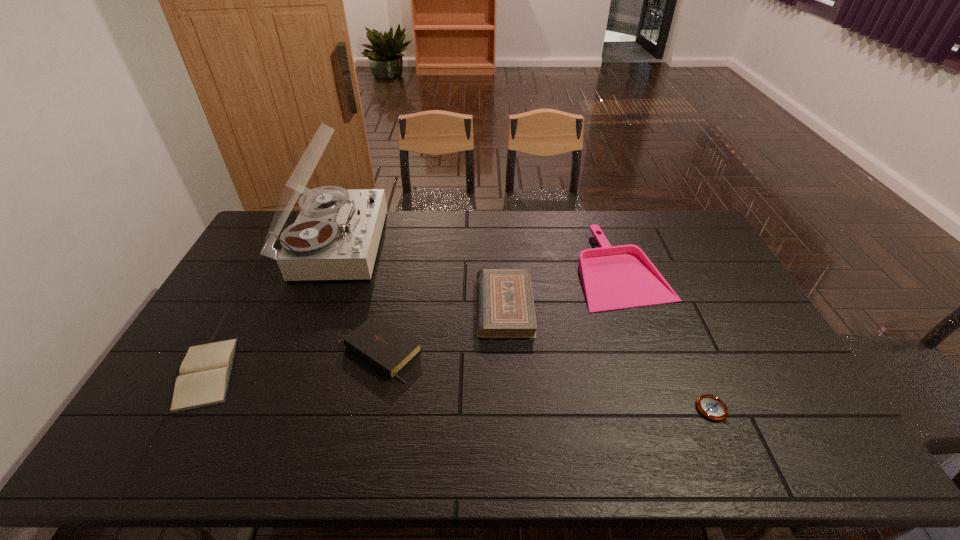
Identify the location of the tallest object. (336, 235).

The image size is (960, 540). In order to click on dustpan in this screenshot , I will do `click(614, 277)`.

This screenshot has width=960, height=540. Find the location of `the rightmost Bible`. the rightmost Bible is located at coordinates (505, 307).

Where is `the second Bible from right to left`? The image size is (960, 540). the second Bible from right to left is located at coordinates (384, 346).

Where is `the leftmost Bible`? the leftmost Bible is located at coordinates (205, 372).

I want to click on compass, so click(x=710, y=406).

At what (x,y) coordinates should I click in order to perform the action: click on vacant space situated 0.190m on the front of the record player. Please return your answer as a coordinate pair (x, y). Looking at the image, I should click on (302, 327).

At what (x,y) coordinates should I click in order to perform the action: click on free space located 0.210m on the handle side of the dustpan. Please return your answer as a coordinate pair (x, y). The height and width of the screenshot is (540, 960). Looking at the image, I should click on (517, 269).

This screenshot has height=540, width=960. I want to click on free space located on the handle side of the dustpan, so point(529,269).

This screenshot has height=540, width=960. Identify the location of vacant space situated on the handle side of the dustpan. (558, 269).